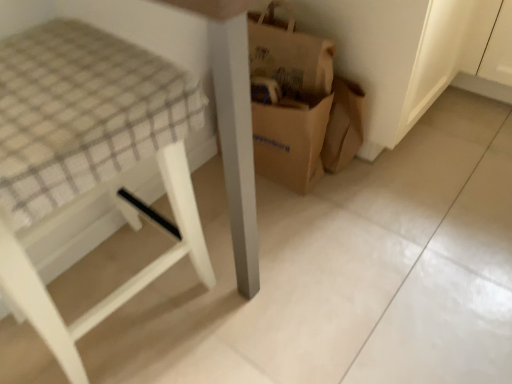
You are a GUI agent. You are given a task and a screenshot of the screen. Output one action in this format:
    pyautogui.click(x=<x>, y=<y>)
    Task: Click on the vacant point to the right of white wood stool at left
    This screenshot has height=384, width=512.
    Given the screenshot: What is the action you would take?
    pyautogui.click(x=286, y=333)